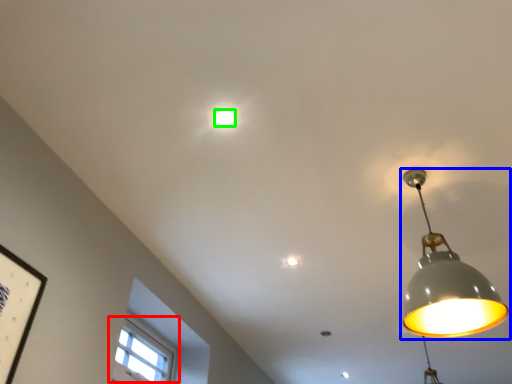
Question: Estimate the real-world distances between objects in this image. Which object is farther from window (highlighted by a red box), lamp (highlighted by a blue box) or lamp (highlighted by a green box)?

Choices:
 (A) lamp
 (B) lamp

Answer: (B)